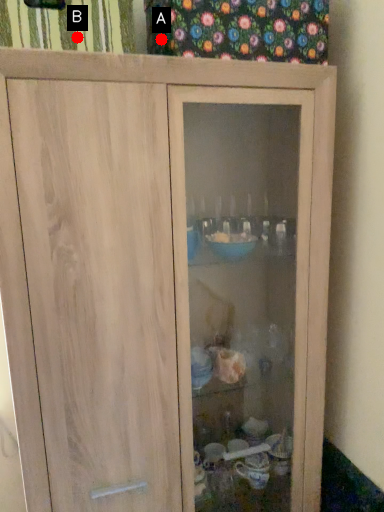
Question: Two points are circled on the image, labeled by A and B beside each circle. Among these points, which one is nearest to the camera?

Choices:
 (A) A is closer
 (B) B is closer

Answer: (B)